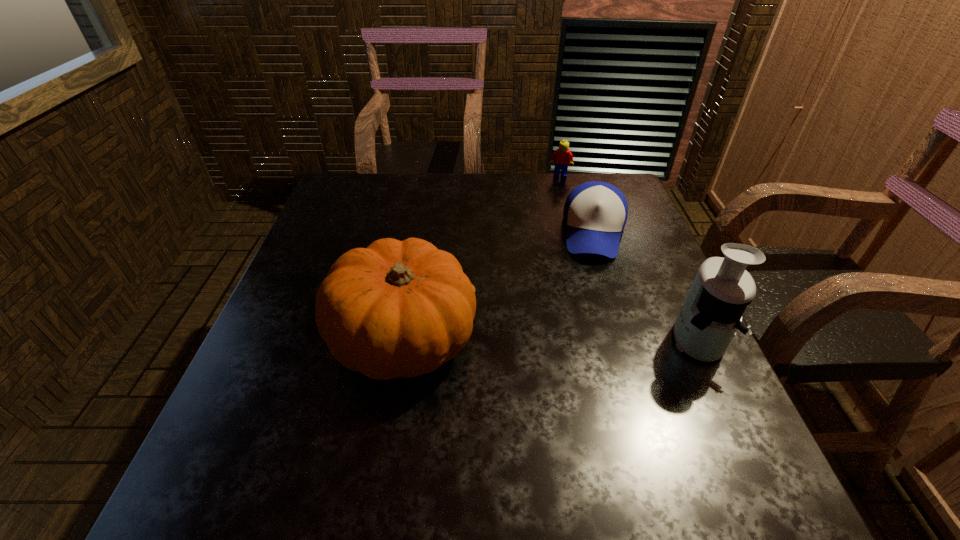
Find the location of `free space on the desktop that is between the third shortest object and the tallest object and is positioned on the front-facing side of the Lego`. free space on the desktop that is between the third shortest object and the tallest object and is positioned on the front-facing side of the Lego is located at coordinates click(570, 339).

Where is `vacant space on the desktop that is between the second tallest object and the tallest object and is positioned on the front-facing side of the third nearest object`? vacant space on the desktop that is between the second tallest object and the tallest object and is positioned on the front-facing side of the third nearest object is located at coordinates (586, 339).